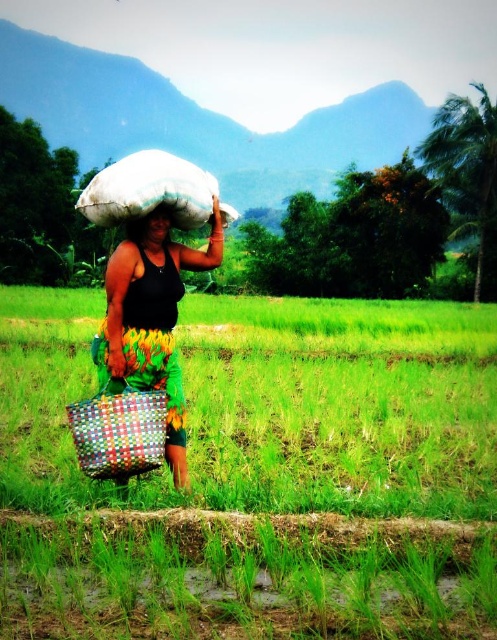
Question: Based on their relative distances, which object is nearer to the multicolored woven basket at center?

Choices:
 (A) multicolored woven basket at lower left
 (B) green grass at center
 (C) white fabric sack at center

Answer: (A)

Question: Is multicolored woven basket at center positioned behind matte black head at upper center?

Choices:
 (A) yes
 (B) no

Answer: (A)

Question: Does multicolored woven basket at center lie behind matte black head at upper center?

Choices:
 (A) yes
 (B) no

Answer: (A)

Question: Which object is the farthest from the white fabric sack at center?

Choices:
 (A) green grass at center
 (B) multicolored woven basket at lower left

Answer: (A)

Question: Does white fabric sack at center lie in front of matte black head at upper center?

Choices:
 (A) yes
 (B) no

Answer: (A)

Question: Estimate the real-world distances between objects in this image. Which object is closer to the multicolored woven basket at center?

Choices:
 (A) matte black head at upper center
 (B) multicolored woven basket at lower left
 (C) green grass at center
 (D) white fabric sack at center

Answer: (B)